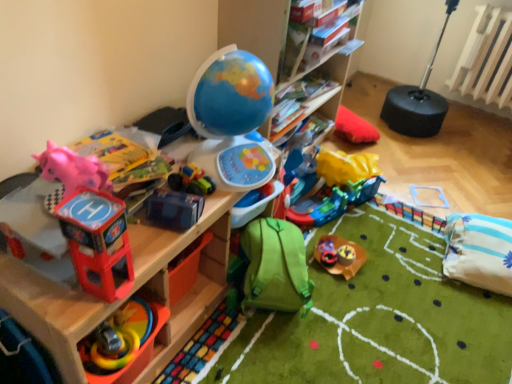
Where is `free spot in front of blue plastic toy at center, the 4th toy viewed from the left`? This screenshot has height=384, width=512. free spot in front of blue plastic toy at center, the 4th toy viewed from the left is located at coordinates (151, 245).